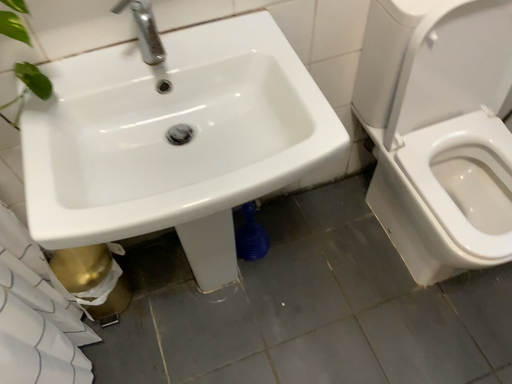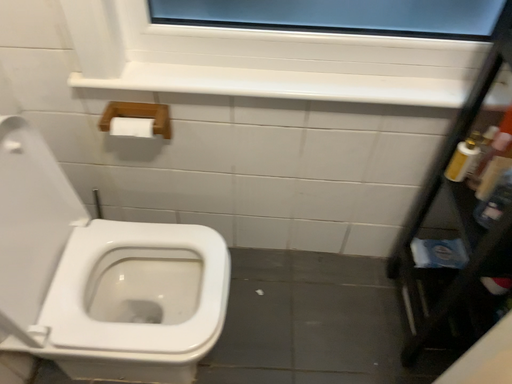
Question: Which way did the camera rotate in the video?

Choices:
 (A) rotated left
 (B) rotated right

Answer: (B)